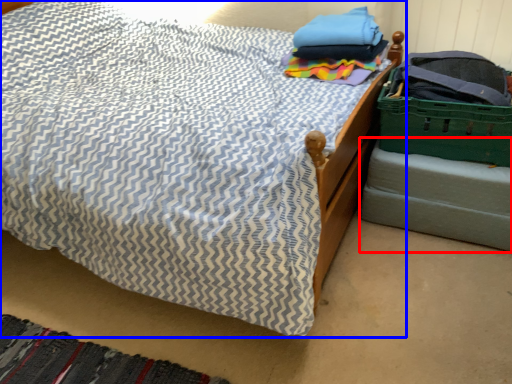
Question: Among these objects, which one is nearest to the camera, bed frame (highlighted by a red box) or bed (highlighted by a blue box)?

Choices:
 (A) bed frame
 (B) bed

Answer: (B)